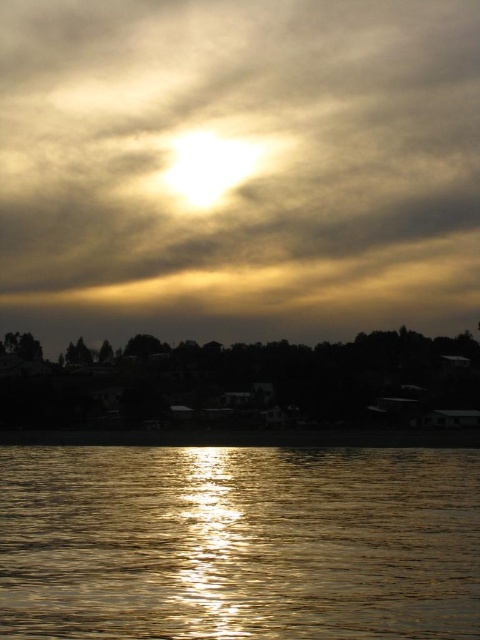
Which is more to the right, glistening reflective water at lower center or dark matte trees at lower center?

glistening reflective water at lower center

In the scene shown: Is glistening reflective water at lower center thinner than dark matte trees at lower center?

Yes.

Identify the location of glistening reflective water at lower center. (239, 541).

Locate an element on the screen. This screenshot has width=480, height=640. glistening reflective water at lower center is located at coordinates (239, 541).

Who is more distant from viewer, (54, 72) or (168, 592)?

The point (54, 72) is more distant.

Between golden translucent cloud at upper center and glistening reflective water at lower center, which one appears on the left side from the viewer's perspective?

golden translucent cloud at upper center is more to the left.

This screenshot has width=480, height=640. What do you see at coordinates (241, 179) in the screenshot?
I see `golden translucent cloud at upper center` at bounding box center [241, 179].

I want to click on golden translucent cloud at upper center, so pos(241,179).

Which is below, golden translucent cloud at upper center or dark matte trees at lower center?

Positioned lower is dark matte trees at lower center.

Which is above, golden translucent cloud at upper center or dark matte trees at lower center?

golden translucent cloud at upper center

Who is more distant from viewer, (x=110, y=202) or (x=212, y=387)?

Point (x=110, y=202)

You are a GUI agent. You are given a task and a screenshot of the screen. Output one action in this format:
    pyautogui.click(x=<x>, y=<y>)
    Task: Click on the golden translucent cloud at upper center
    Image resolution: width=480 pixels, height=640 pixels.
    Given the screenshot: What is the action you would take?
    pyautogui.click(x=241, y=179)